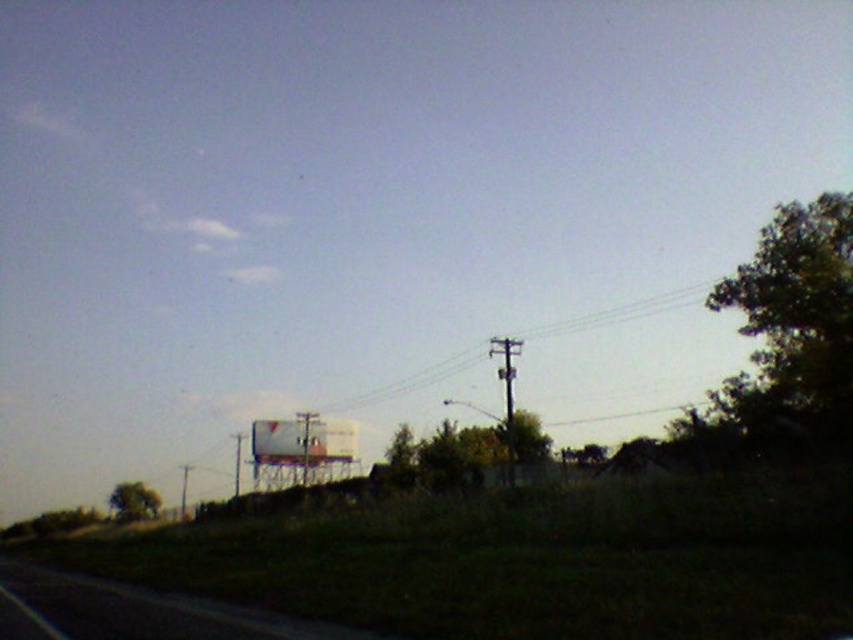
You are driving along the road and notice the metallic wire at center and the smooth wooden pole at center right. Which object is closer to your current position?

The metallic wire at center is closer to your current position because the smooth wooden pole at center right is behind it.

You are driving along the road at lower left and see a point marked at coordinates (146,611). Is this point located on the asphalt road or somewhere else?

The point at (146,611) is on the asphalt road at lower left.